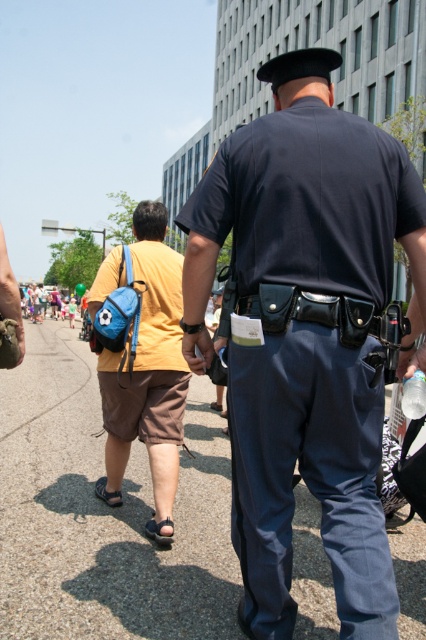
Which is more to the left, navy blue uniform at center or matte blue backpack at center?

matte blue backpack at center is more to the left.

Is navy blue uniform at center further to the viewer compared to matte blue backpack at center?

No, it is in front of matte blue backpack at center.

Which is behind, point (325, 396) or point (111, 280)?

The point (111, 280) is behind.

What are the coordinates of `navy blue uniform at center` in the screenshot? It's located at (305, 333).

Can you confirm if navy blue uniform at center is shorter than gray asphalt pavement at center?

No, navy blue uniform at center is not shorter than gray asphalt pavement at center.

What are the coordinates of `navy blue uniform at center` in the screenshot? It's located at (305, 333).

Can you confirm if gray asphalt pavement at center is positioned to the right of matte blue backpack at center?

In fact, gray asphalt pavement at center is to the left of matte blue backpack at center.

Is gray asphalt pavement at center smaller than matte blue backpack at center?

No.

At what (x,y) coordinates should I click in order to perform the action: click on gray asphalt pavement at center. Please return your answer as a coordinate pair (x, y). Looking at the image, I should click on (104, 513).